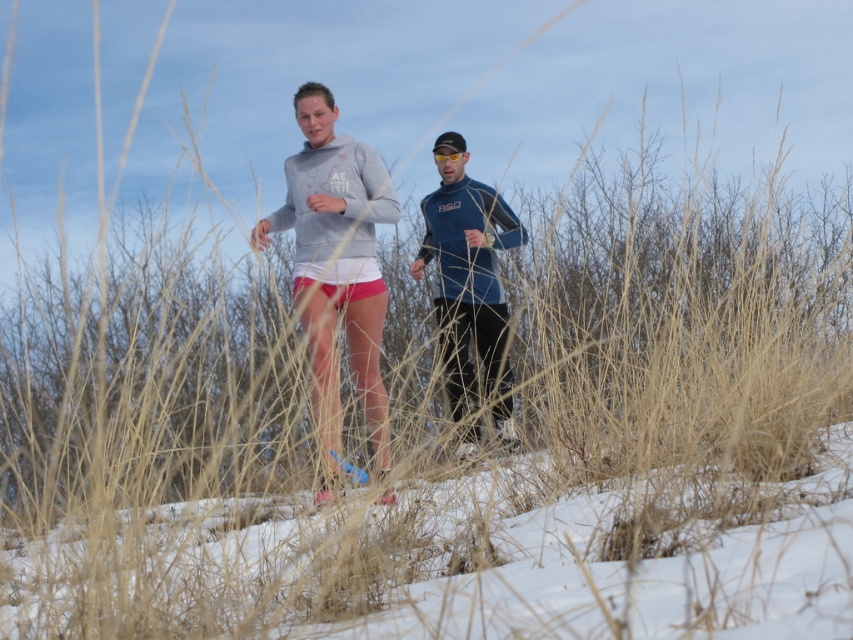
You are a photographer trying to capture a photo of the two points in the image. Which point, point (363,186) or point (485,314), will appear larger in your photo?

Point (363,186) is closer to the viewer than point (485,314), so it will appear larger in the photo.

You are standing at the camera position and want to throw a snowball to the point at coordinates point (312, 154). Can you estimate how far you need to throw the snowball to reach that point?

The distance between the camera and point (312, 154) is 7.00 meters, so you need to throw the snowball approximately 7.00 meters to reach that point.